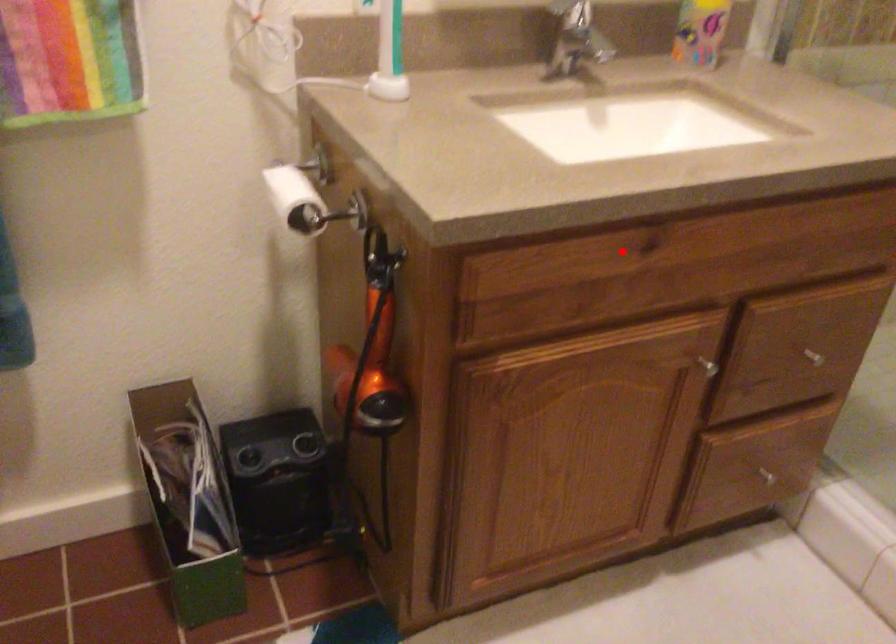
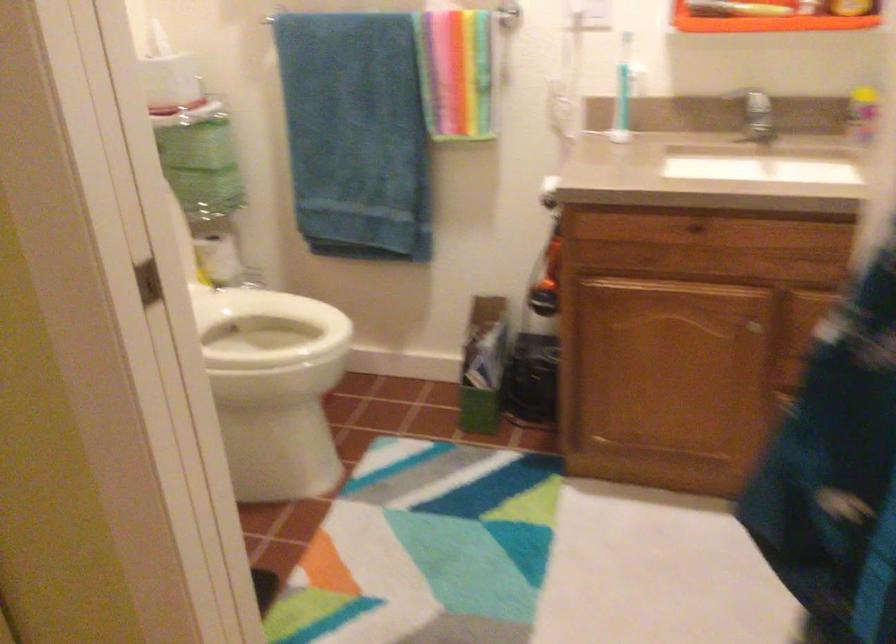
Locate, in the second image, the point that corresponds to the highlighted location in the first image.

(692, 229)